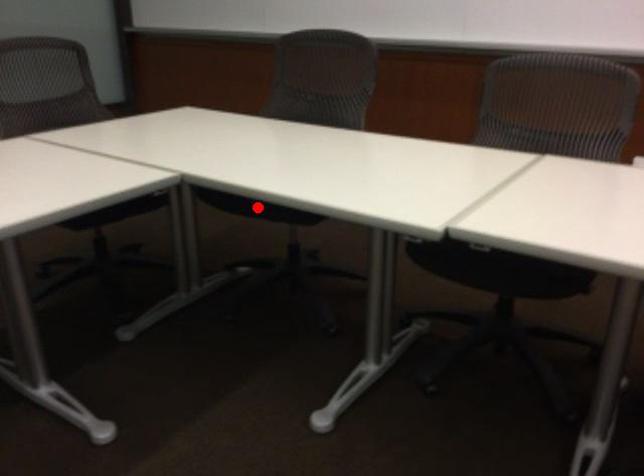
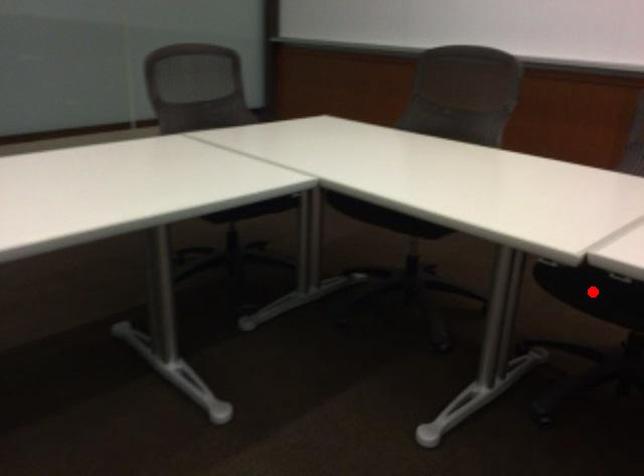
I am providing you with two images of the same scene from different viewpoints. A red point is marked on the first image and another point is marked on the second image. Does the point marked in image1 correspond to the same location as the one in image2?

No